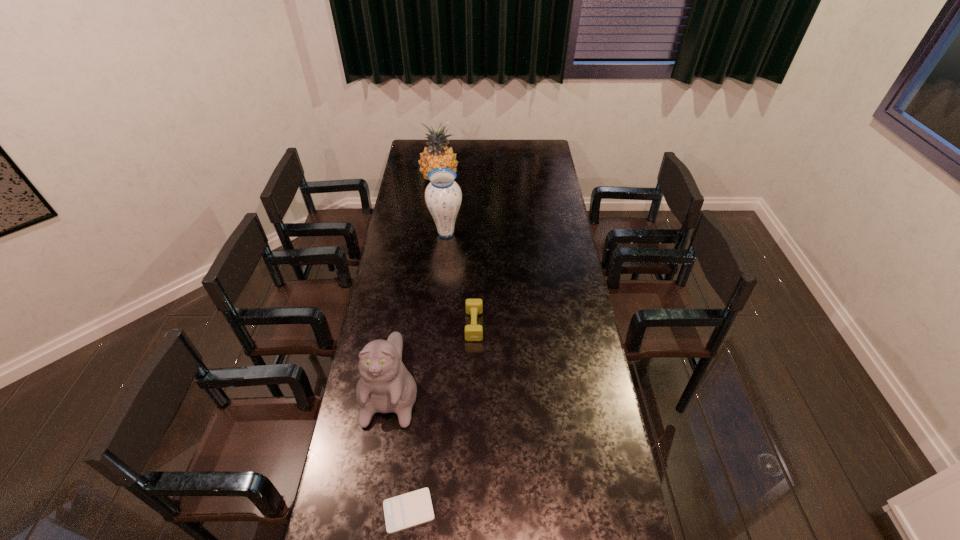
Image resolution: width=960 pixels, height=540 pixels. What are the coordinates of `the farthest object` in the screenshot? It's located at (437, 155).

Where is `the second farthest object`? the second farthest object is located at coordinates (443, 196).

Identify the location of cat. (385, 386).

This screenshot has width=960, height=540. I want to click on dumbbell, so click(x=473, y=332).

Where is `the rightmost object`? This screenshot has height=540, width=960. the rightmost object is located at coordinates (473, 332).

Locate an element on the screen. The height and width of the screenshot is (540, 960). the shortest object is located at coordinates (413, 508).

The width and height of the screenshot is (960, 540). In order to click on calculator in this screenshot , I will do 413,508.

Find the location of `vacant space located 0.150m on the front of the farthest object`. vacant space located 0.150m on the front of the farthest object is located at coordinates (436, 207).

You are a GUI agent. You are given a task and a screenshot of the screen. Output one action in this format:
    pyautogui.click(x=<x>, y=<y>)
    Task: Click on the vacant region located on the front of the vase
    Image resolution: width=960 pixels, height=540 pixels.
    Given the screenshot: What is the action you would take?
    pyautogui.click(x=444, y=259)

At what (x,y) coordinates should I click in order to perform the action: click on free space located 0.230m on the face of the cat. Please return your answer as a coordinate pair (x, y). Image resolution: width=960 pixels, height=540 pixels. Looking at the image, I should click on (372, 503).